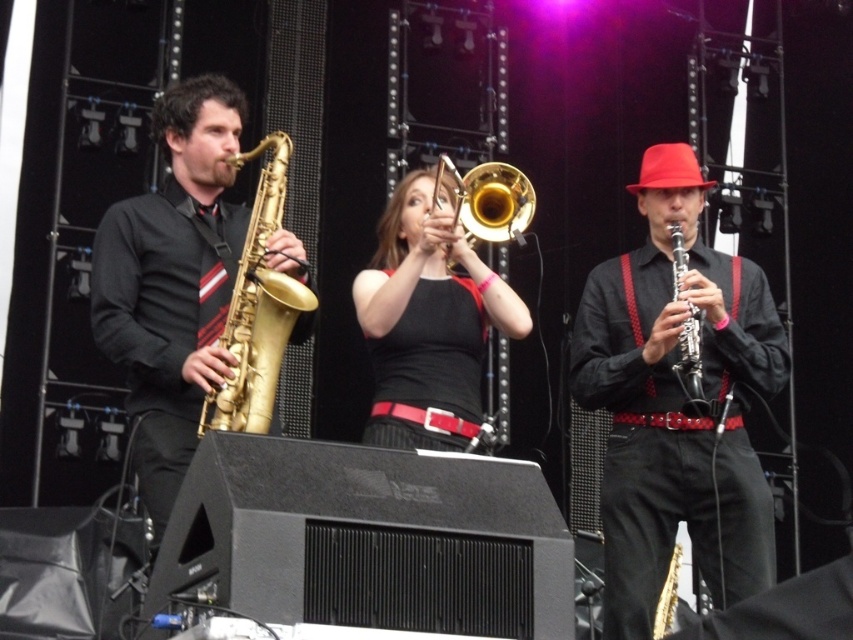
You are a stagehand adjusting microphone stands for the jazz band. The gold brass trumpet at center and the black wood clarinet at center are both on stage. Which instrument requires a taller microphone stand to accommodate its height?

The gold brass trumpet at center requires a taller microphone stand because it has a greater height compared to the black wood clarinet at center.